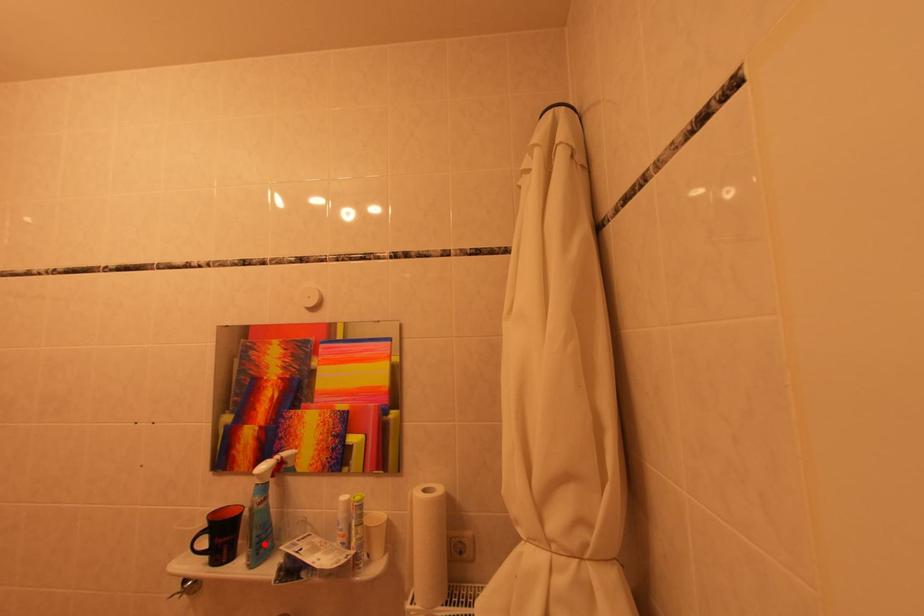
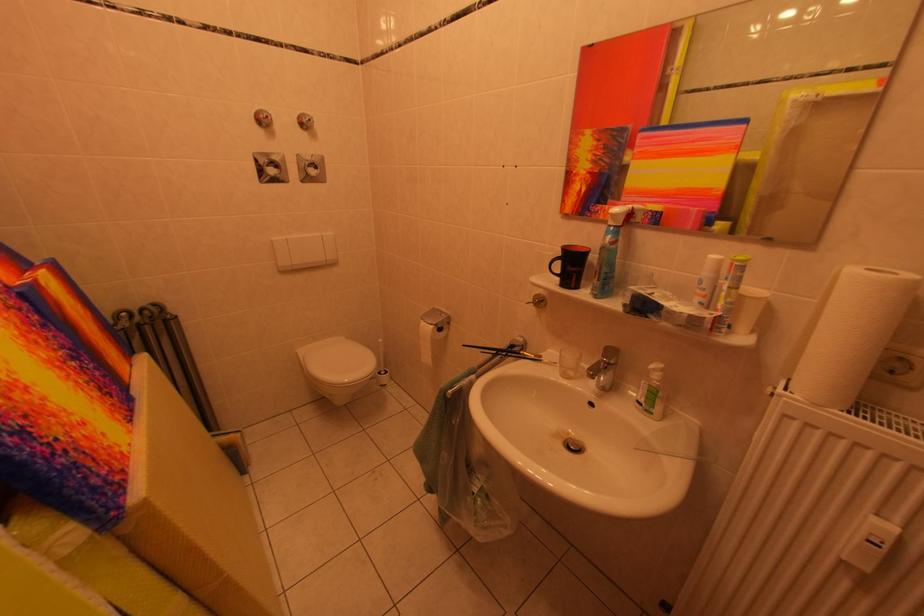
In the second image, find the point that corresponds to the highlighted location in the first image.

(613, 280)